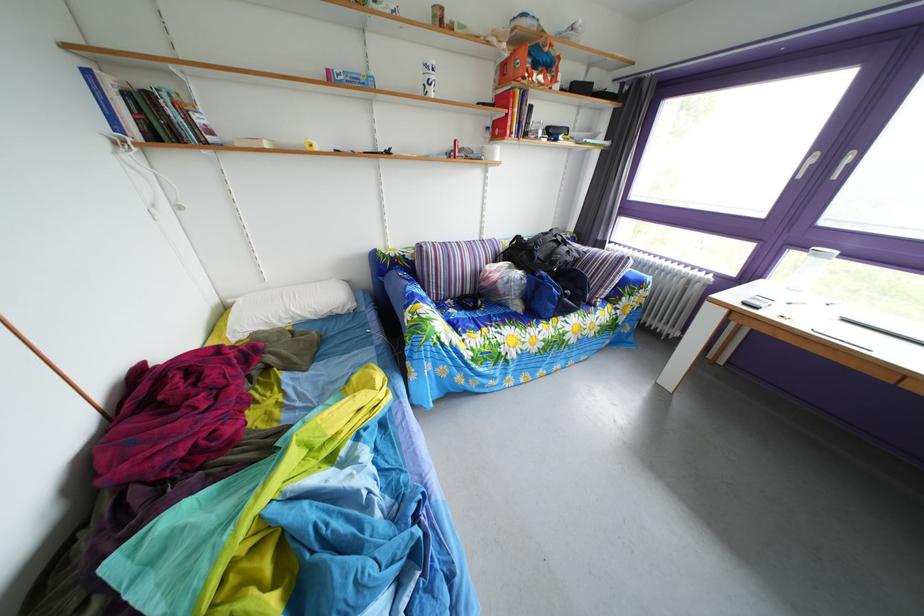
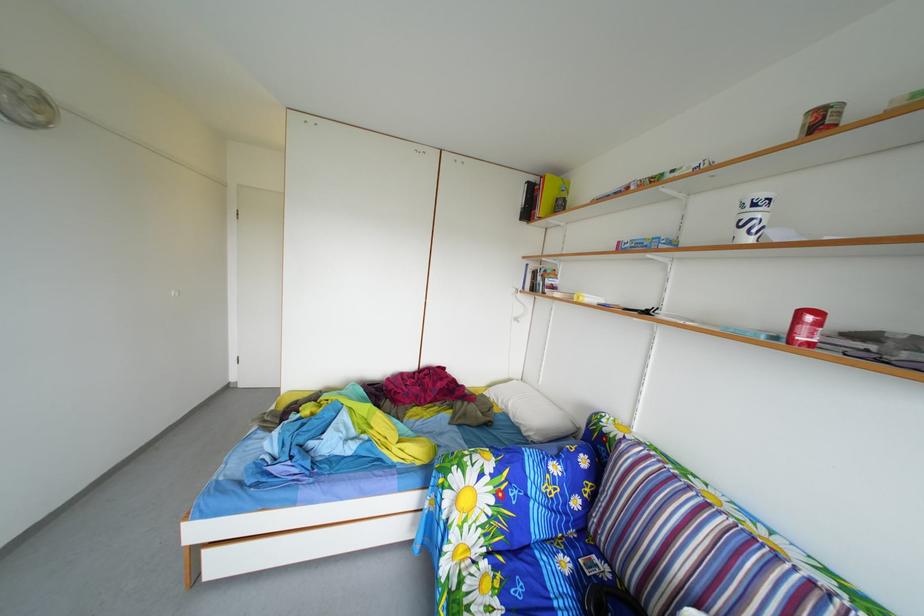
Where in the second image is the point corresponding to (454,352) from the first image?

(453, 507)